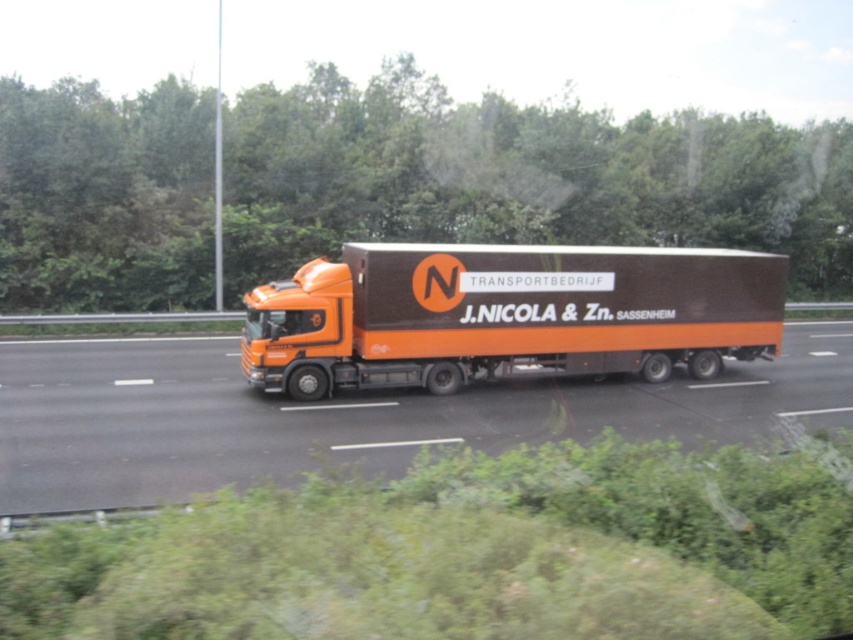
Between orange matte truck at center and orange matte trailer truck at center, which one is positioned lower?

orange matte truck at center is below.

Does point (341, 442) come in front of point (415, 356)?

Yes.

You are a GUI agent. You are given a task and a screenshot of the screen. Output one action in this format:
    pyautogui.click(x=<x>, y=<y>)
    Task: Click on the orange matte truck at center
    The width and height of the screenshot is (853, 640).
    Given the screenshot: What is the action you would take?
    pyautogui.click(x=345, y=416)